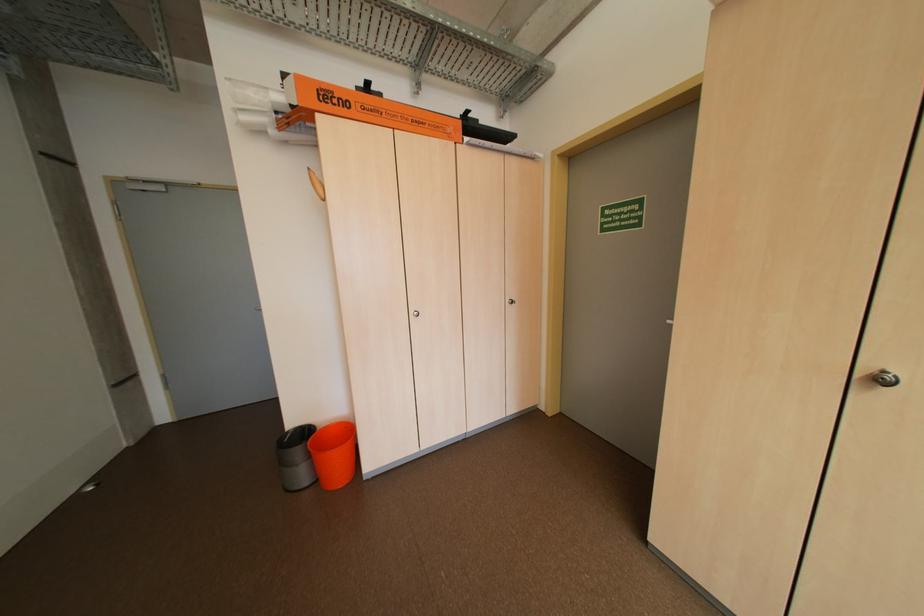
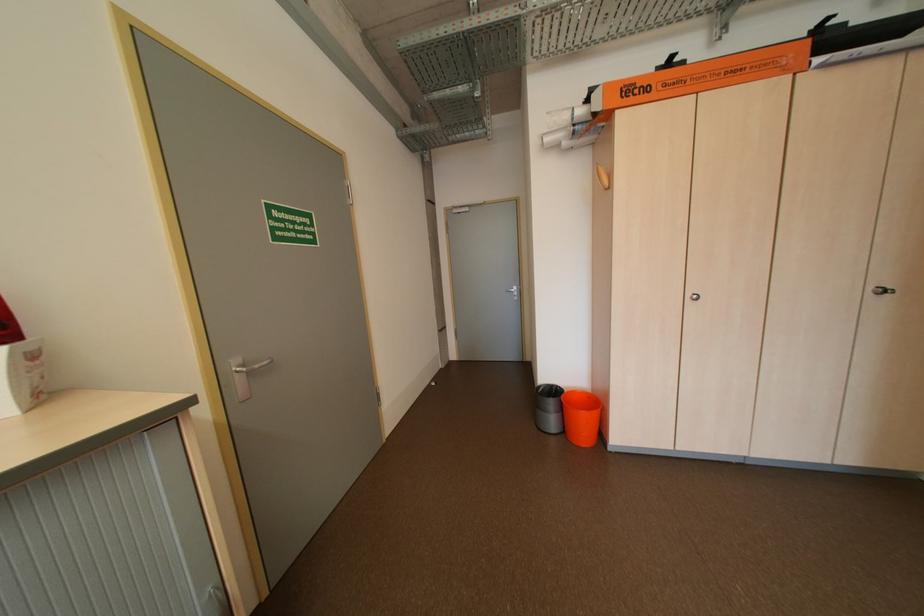
In the second image, find the point that corresponds to point 288,99 in the first image.

(590, 113)